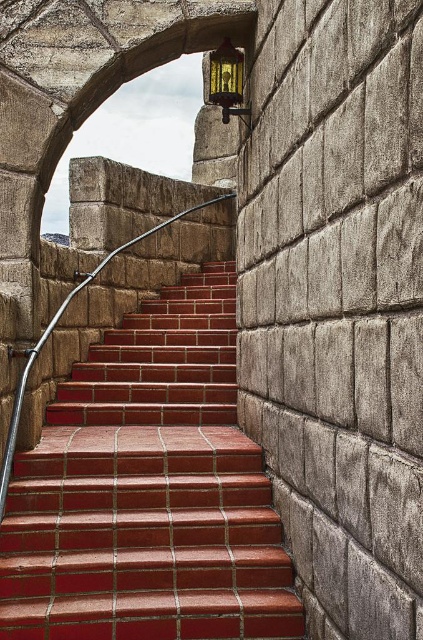
Does red brick stairs at center appear on the right side of gold textured lantern at upper center?

In fact, red brick stairs at center is to the left of gold textured lantern at upper center.

Which of these two, red brick stairs at center or gold textured lantern at upper center, stands shorter?

Standing shorter between the two is red brick stairs at center.

Identify the location of red brick stairs at center. (148, 490).

Find the location of a particular element. The image size is (423, 640). red brick stairs at center is located at coordinates (148, 490).

Can you confirm if red brick stairs at center is positioned to the right of polished metal handrail at center?

Indeed, red brick stairs at center is positioned on the right side of polished metal handrail at center.

Does red brick stairs at center have a lesser width compared to polished metal handrail at center?

No, red brick stairs at center is not thinner than polished metal handrail at center.

Which is behind, point (115, 356) or point (13, 348)?

The point (115, 356) is more distant.

The image size is (423, 640). Find the location of `red brick stairs at center`. red brick stairs at center is located at coordinates tap(148, 490).

Does point (25, 380) come closer to viewer compared to point (227, 65)?

Yes, point (25, 380) is closer to viewer.

Which is behind, point (25, 355) or point (230, 81)?

Point (230, 81)

Does point (13, 438) come closer to viewer compared to point (224, 116)?

Yes, it is.

Locate an element on the screen. polished metal handrail at center is located at coordinates (54, 328).